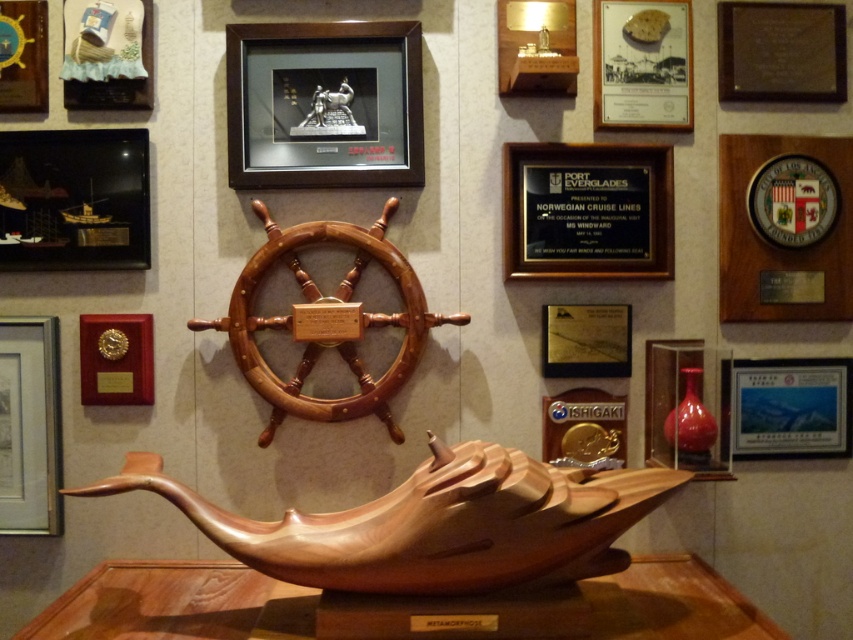
Is matte wooden picture frame at right positioned before wooden ship at upper left?

No, it is not.

Is point (804, 440) less distant than point (70, 86)?

No, (804, 440) is further to viewer.

The height and width of the screenshot is (640, 853). Describe the element at coordinates (792, 406) in the screenshot. I see `matte wooden picture frame at right` at that location.

You are a GUI agent. You are given a task and a screenshot of the screen. Output one action in this format:
    pyautogui.click(x=<x>, y=<y>)
    Task: Click on the matte wooden picture frame at right
    The width and height of the screenshot is (853, 640).
    Given the screenshot: What is the action you would take?
    pyautogui.click(x=792, y=406)

This screenshot has width=853, height=640. Identify the location of wooden boat at lower center. (434, 524).

Can you confirm if wooden boat at lower center is positioned below wooden plaque at upper right?

Indeed, wooden boat at lower center is positioned under wooden plaque at upper right.

Who is more forward, (506, 460) or (766, 20)?

Point (506, 460) is in front.

The width and height of the screenshot is (853, 640). Find the location of `wooden boat at lower center`. wooden boat at lower center is located at coordinates point(434,524).

Describe the element at coordinates (587, 211) in the screenshot. This screenshot has height=640, width=853. I see `black plaque at upper center` at that location.

Is point (525, 262) positioned before point (144, 204)?

No.

Which is behind, point (590, 202) or point (80, 154)?

Positioned behind is point (590, 202).

At what (x,y) coordinates should I click in order to perform the action: click on black plaque at upper center. Please return your answer as a coordinate pair (x, y). Looking at the image, I should click on (587, 211).